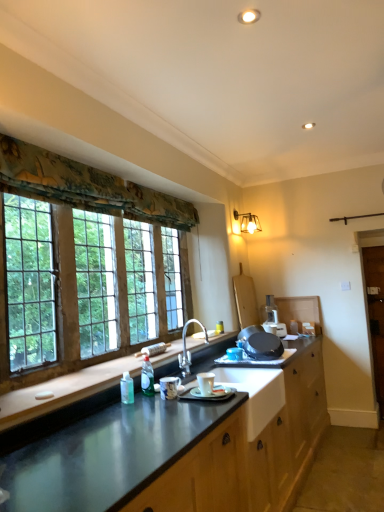
Question: Looking at the image, does white plastic food processor at center seem bigger or smaller compared to floral fabric curtain at upper left?

Choices:
 (A) big
 (B) small

Answer: (B)

Question: In the image, is white plastic food processor at center positioned in front of or behind floral fabric curtain at upper left?

Choices:
 (A) front
 (B) behind

Answer: (B)

Question: Which object is the farthest from the metallic gray countertop at center, acting as the first countertop starting from the bottom?

Choices:
 (A) metallic wall sconce at upper right
 (B) clear glass window at left
 (C) metallic gray countertop at lower center, arranged as the 1th countertop when viewed from the top
 (D) white plastic food processor at center
 (E) floral fabric curtain at upper left

Answer: (A)

Question: Which object is the farthest from the metallic gray countertop at center, acting as the first countertop starting from the bottom?

Choices:
 (A) brown wooden barn door at right
 (B) clear glass window at left
 (C) metallic wall sconce at upper right
 (D) white plastic food processor at center
 (E) white ceramic sink at center

Answer: (C)